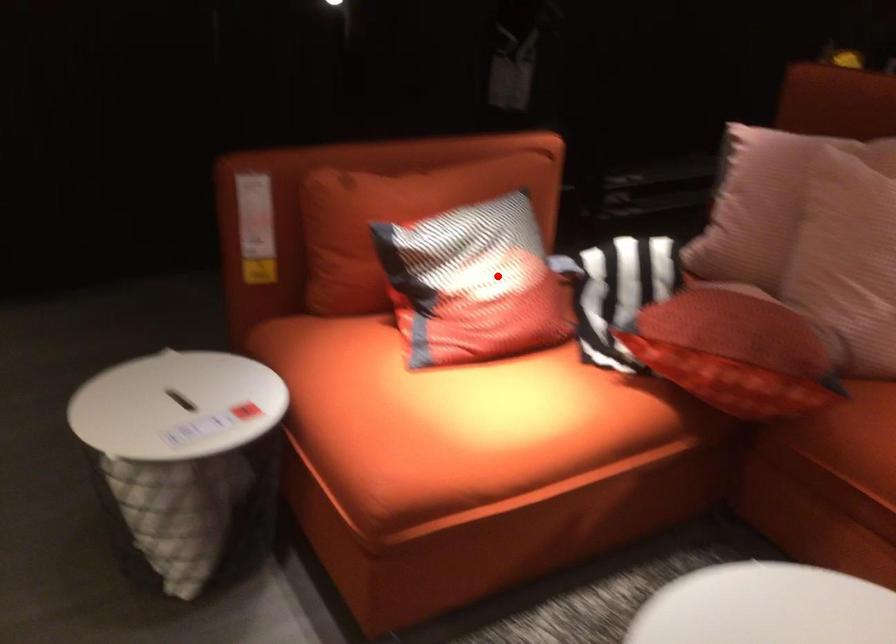
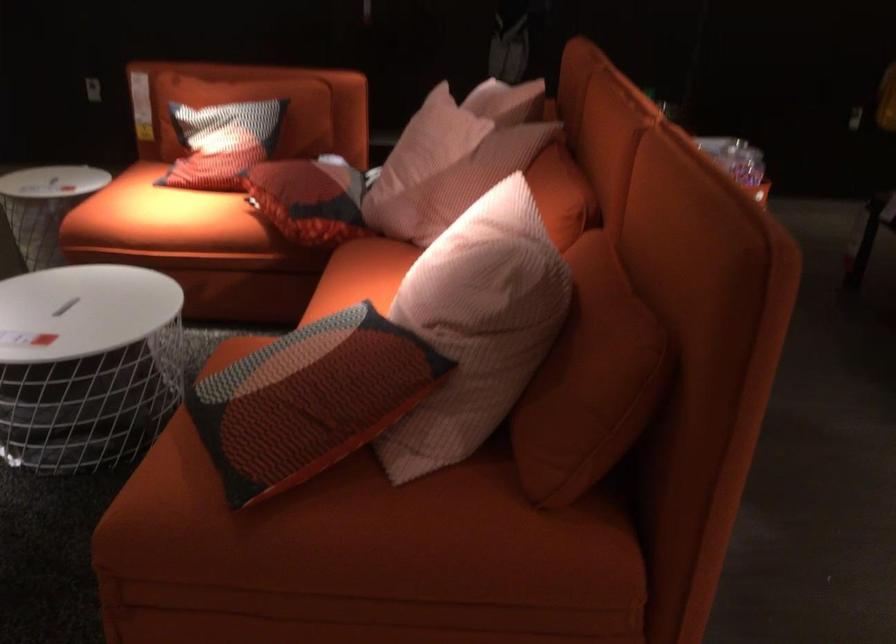
The point at the highlighted location is marked in the first image. Where is the corresponding point in the second image?

(222, 142)